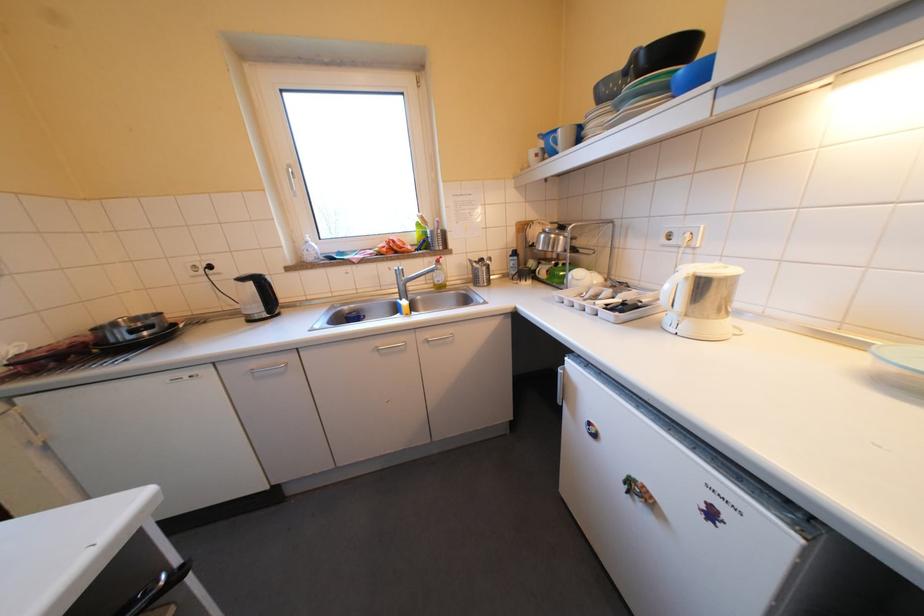
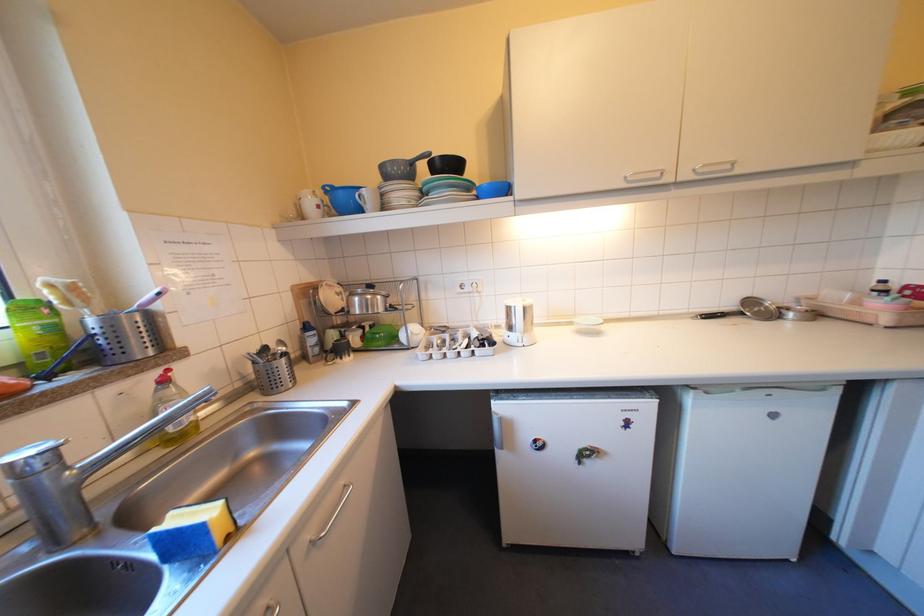
In the second image, find the point that corresponds to pixel 544 262 in the first image.

(346, 334)